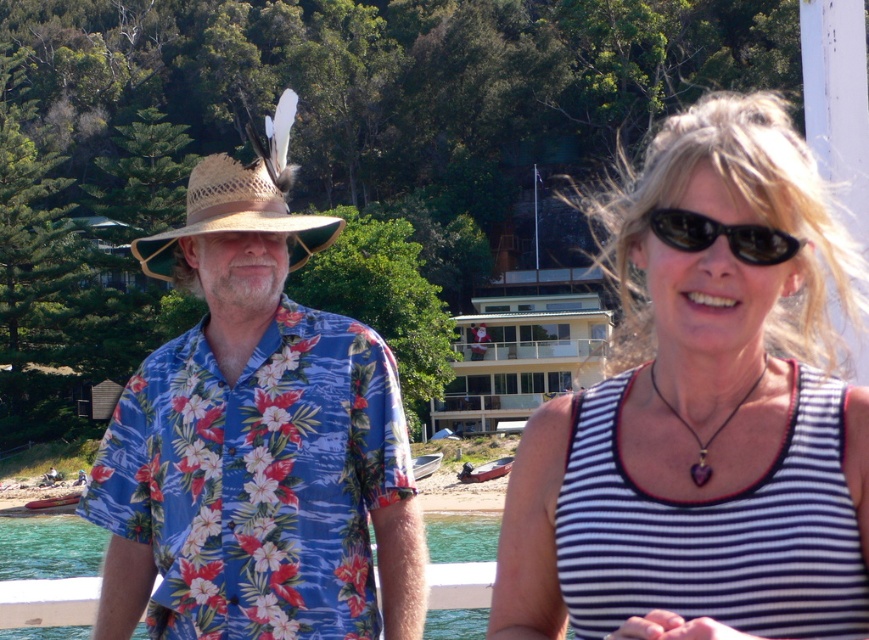
Question: Can you confirm if white striped tank top at center is positioned to the right of clear water at lower left?

Choices:
 (A) no
 (B) yes

Answer: (B)

Question: Which object is the closest to the black plastic sunglasses at upper right?

Choices:
 (A) clear water at lower left
 (B) floral print fabric shirt at left
 (C) white striped tank top at center
 (D) strawhat at left

Answer: (B)

Question: In this image, where is strawhat at left located relative to clear water at lower left?

Choices:
 (A) below
 (B) above

Answer: (B)

Question: Which object is farther from the camera taking this photo?

Choices:
 (A) white striped tank top at center
 (B) floral print fabric shirt at left
 (C) clear water at lower left

Answer: (C)

Question: Does floral print fabric shirt at left appear under strawhat at left?

Choices:
 (A) no
 (B) yes

Answer: (B)

Question: Which of the following is the farthest from the observer?

Choices:
 (A) strawhat at left
 (B) floral print fabric shirt at left
 (C) clear water at lower left

Answer: (C)